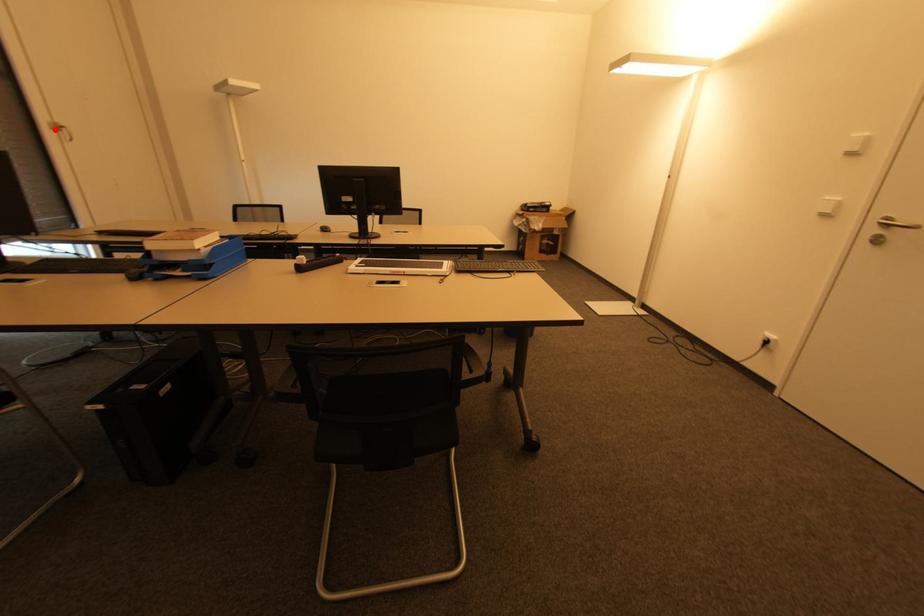
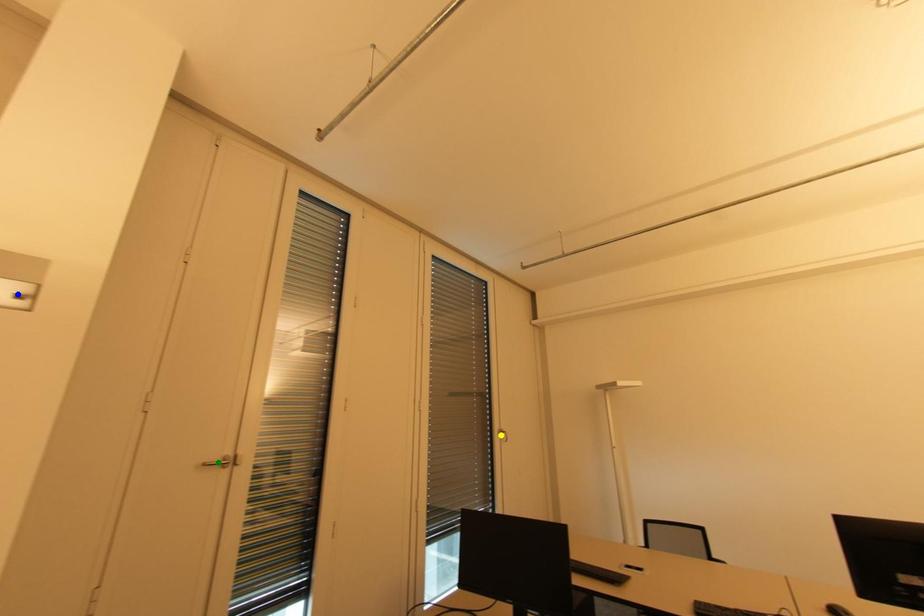
Question: I am providing you with two images of the same scene from different viewpoints. A red point is marked on the first image. You are given multiple points on the second image. Which mark in image 2 goes with the point in image 1?

Choices:
 (A) yellow point
 (B) green point
 (C) blue point

Answer: (A)